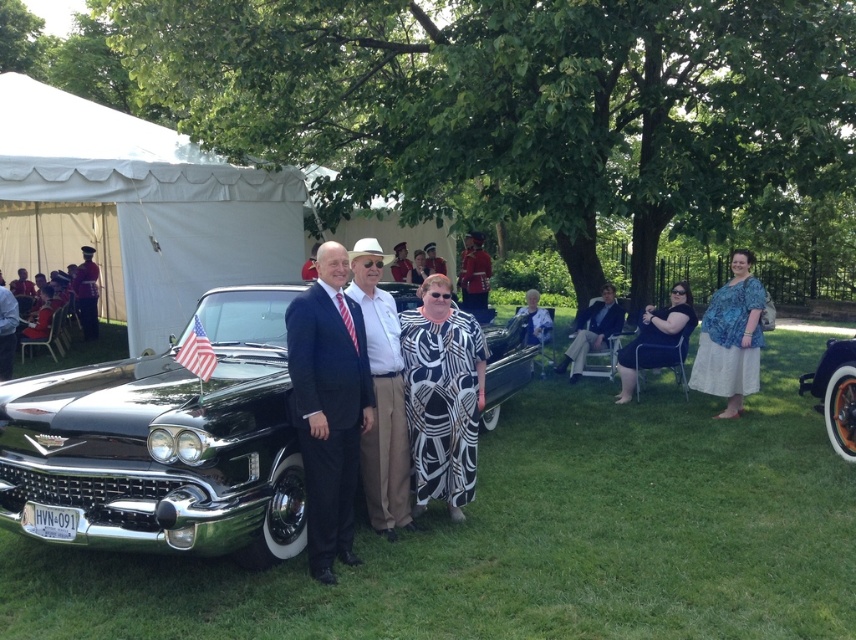
Question: Among these points, which one is farthest from the camera?

Choices:
 (A) (477, 257)
 (B) (421, 250)
 (C) (295, 426)
 (D) (384, 381)

Answer: (B)

Question: Does shiny red uniform at center appear on the left side of shiny red uniform at left?

Choices:
 (A) yes
 (B) no

Answer: (B)

Question: Which object appears closest to the camera in this image?

Choices:
 (A) matte black suit at left
 (B) printed fabric dress at center
 (C) patterned fabric dress at center

Answer: (A)

Question: Can you confirm if patterned fabric dress at center is positioned to the left of printed fabric dress at center?

Choices:
 (A) no
 (B) yes

Answer: (A)

Question: Which object is the closest to the shiny black car at center?

Choices:
 (A) shiny red uniform at left
 (B) white fabric tent at upper left

Answer: (B)

Question: Is white fabric tent at upper left above matte white hat at center?

Choices:
 (A) no
 (B) yes

Answer: (B)